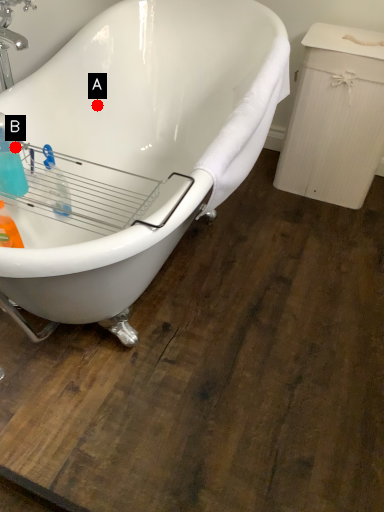
Question: Two points are circled on the image, labeled by A and B beside each circle. Which point is farther to the camera?

Choices:
 (A) A is further
 (B) B is further

Answer: (A)